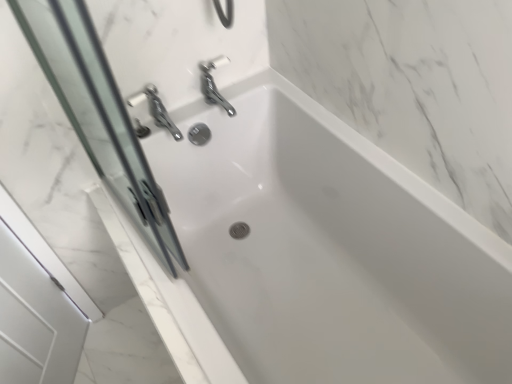
What do you see at coordinates (98, 114) in the screenshot?
I see `transparent glass screen door at left` at bounding box center [98, 114].

You are a GUI agent. You are given a task and a screenshot of the screen. Output one action in this format:
    pyautogui.click(x=<x>, y=<y>)
    Task: Click on the transparent glass screen door at left
    The width and height of the screenshot is (512, 384).
    Given the screenshot: What is the action you would take?
    pyautogui.click(x=98, y=114)

Looking at this image, measure the distance between white glossy bathtub at center and camera.

white glossy bathtub at center and camera are 35.27 inches apart from each other.

The height and width of the screenshot is (384, 512). Describe the element at coordinates (329, 249) in the screenshot. I see `white glossy bathtub at center` at that location.

This screenshot has width=512, height=384. I want to click on white glossy bathtub at center, so click(x=329, y=249).

Where is `transparent glass screen door at left`? This screenshot has width=512, height=384. transparent glass screen door at left is located at coordinates [98, 114].

Which object is positioned more to the right, transparent glass screen door at left or white glossy bathtub at center?

white glossy bathtub at center is more to the right.

Between transparent glass screen door at left and white glossy bathtub at center, which one is positioned in front?

transparent glass screen door at left is closer to the camera.

Which is farther from the camera, (104, 75) or (315, 253)?

The point (315, 253) is behind.

From the image's perspective, is transparent glass screen door at left under white glossy bathtub at center?

Actually, transparent glass screen door at left appears above white glossy bathtub at center in the image.

From a real-world perspective, is transparent glass screen door at left located beneath white glossy bathtub at center?

No, from a real-world perspective, transparent glass screen door at left is not beneath white glossy bathtub at center.

Which object is wider, transparent glass screen door at left or white glossy bathtub at center?

white glossy bathtub at center.

Which of these two, transparent glass screen door at left or white glossy bathtub at center, stands taller?

With more height is transparent glass screen door at left.

Considering the relative sizes of transparent glass screen door at left and white glossy bathtub at center in the image provided, is transparent glass screen door at left bigger than white glossy bathtub at center?

No, transparent glass screen door at left is not bigger than white glossy bathtub at center.

Is transparent glass screen door at left inside the boundaries of white glossy bathtub at center, or outside?

transparent glass screen door at left lies outside white glossy bathtub at center.

Would you consider transparent glass screen door at left to be distant from white glossy bathtub at center?

No.

Is transparent glass screen door at left facing away from white glossy bathtub at center?

No, transparent glass screen door at left is not facing away from white glossy bathtub at center.

How many degrees apart are the facing directions of transparent glass screen door at left and white glossy bathtub at center?

transparent glass screen door at left and white glossy bathtub at center are facing 0.00157 degrees away from each other.

How far apart are transparent glass screen door at left and white glossy bathtub at center?

19.37 inches.

There is a white glossy bathtub at center. Find the location of `screen door above it (from a real-world perspective)`. screen door above it (from a real-world perspective) is located at coordinates (98, 114).

Based on the photo, based on their positions, is white glossy bathtub at center located to the left or right of transparent glass screen door at left?

white glossy bathtub at center is to the right of transparent glass screen door at left.

Which object is more forward, white glossy bathtub at center or transparent glass screen door at left?

Positioned in front is transparent glass screen door at left.

Is point (353, 174) closer to viewer compared to point (80, 134)?

No, (353, 174) is further to viewer.

In the scene shown: From the image's perspective, is white glossy bathtub at center located above or below transparent glass screen door at left?

Based on their image positions, white glossy bathtub at center is located beneath transparent glass screen door at left.

From a real-world perspective, who is located higher, white glossy bathtub at center or transparent glass screen door at left?

From a 3D spatial view, transparent glass screen door at left is above.

Which object is thinner, white glossy bathtub at center or transparent glass screen door at left?

With smaller width is transparent glass screen door at left.

Considering the relative sizes of white glossy bathtub at center and transparent glass screen door at left in the image provided, is white glossy bathtub at center shorter than transparent glass screen door at left?

Yes.

Considering the sizes of white glossy bathtub at center and transparent glass screen door at left in the image, is white glossy bathtub at center bigger or smaller than transparent glass screen door at left?

Clearly, white glossy bathtub at center is larger in size than transparent glass screen door at left.

Is white glossy bathtub at center spatially inside transparent glass screen door at left, or outside of it?

white glossy bathtub at center is not enclosed by transparent glass screen door at left.

Is white glossy bathtub at center positioned far away from transparent glass screen door at left?

No, white glossy bathtub at center is in close proximity to transparent glass screen door at left.

From the picture: Is white glossy bathtub at center looking in the opposite direction of transparent glass screen door at left?

white glossy bathtub at center does not have its back to transparent glass screen door at left.

What's the angular difference between white glossy bathtub at center and transparent glass screen door at left's facing directions?

The angle between the facing direction of white glossy bathtub at center and the facing direction of transparent glass screen door at left is 0.00157 degrees.

Locate an element on the screen. This screenshot has width=512, height=384. bathtub lying behind the transparent glass screen door at left is located at coordinates (329, 249).

Find the location of a particular element. The height and width of the screenshot is (384, 512). bathtub lying below the transparent glass screen door at left (from the image's perspective) is located at coordinates (329, 249).

The width and height of the screenshot is (512, 384). Identify the location of screen door on the left of white glossy bathtub at center. (98, 114).